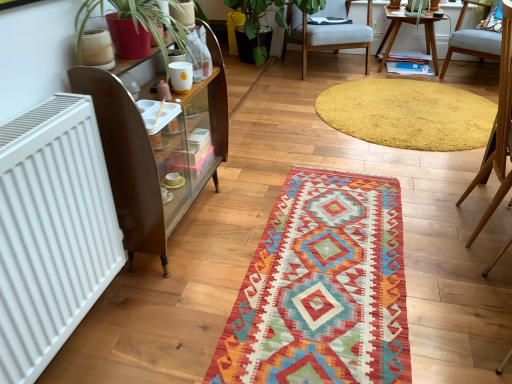
The height and width of the screenshot is (384, 512). What are the coordinates of `free space to the right of brown wooden shelf at left` in the screenshot? It's located at (241, 213).